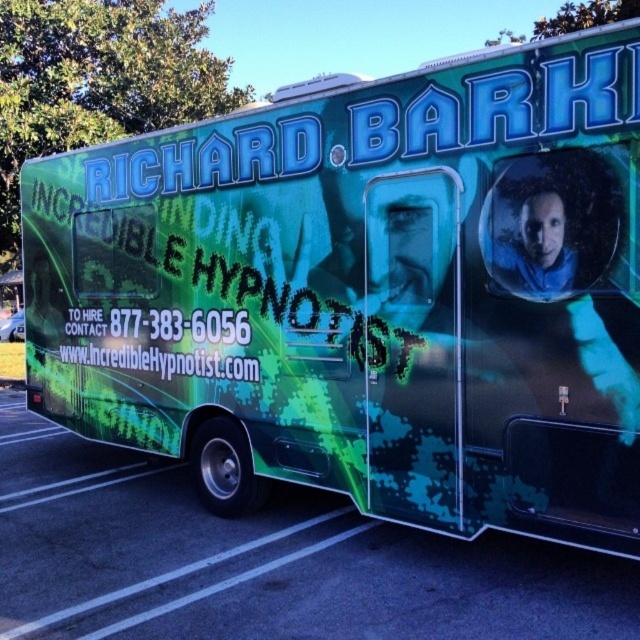
Can you confirm if green camouflage truck at lower left is positioned above white text at center?

Actually, green camouflage truck at lower left is below white text at center.

Does point (468, 580) come farther from viewer compared to point (196, 328)?

No, it is in front of (196, 328).

At what (x,y) coordinates should I click in order to perform the action: click on green camouflage truck at lower left. Please return your answer as a coordinate pair (x, y). Looking at the image, I should click on (260, 561).